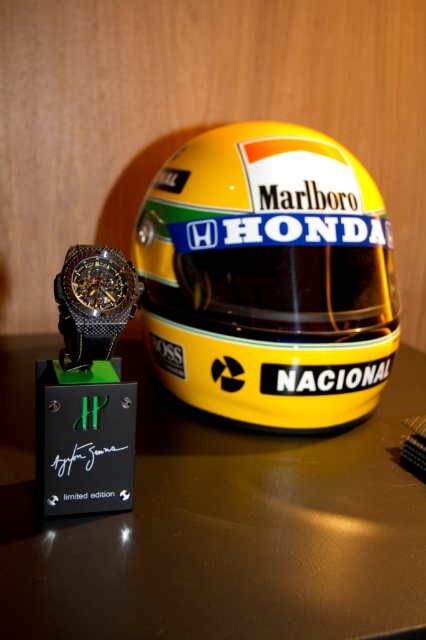
Looking at this image, does yellow matte helmet at center have a larger size compared to black carbon fiber watch at left?

Yes, yellow matte helmet at center is bigger than black carbon fiber watch at left.

Is point (316, 230) positioned in front of point (66, 301)?

No, it is not.

Between point (276, 214) and point (83, 296), which one is positioned in front?

Positioned in front is point (83, 296).

Identify the location of yellow matte helmet at center. pyautogui.click(x=267, y=276).